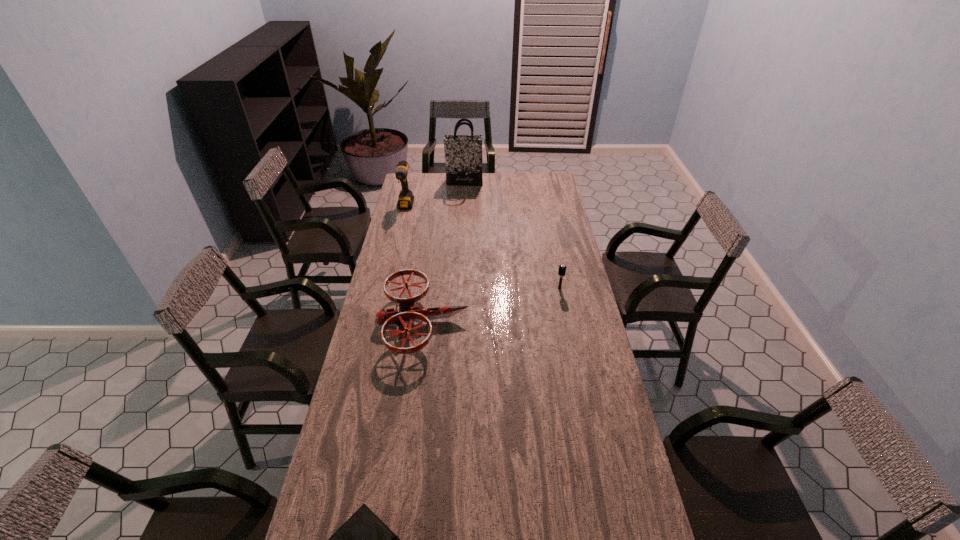
I want to click on vacant region located on the right of the second shortest object, so click(560, 323).

I want to click on object located at the far edge, so coord(463,153).

At what (x,y) coordinates should I click in order to perform the action: click on drill at the left edge. Please return your answer as a coordinate pair (x, y). This screenshot has width=960, height=540. Looking at the image, I should click on (406, 198).

Locate an element on the screen. This screenshot has width=960, height=540. drone that is at the left edge is located at coordinates (406, 312).

Find the location of a particular element. Image resolution: width=960 pixels, height=540 pixels. object situated at the right edge is located at coordinates (562, 268).

In the image, there is a desktop. Where is `vacant space at the far edge`? vacant space at the far edge is located at coordinates (460, 194).

Image resolution: width=960 pixels, height=540 pixels. In the image, there is a desktop. What are the coordinates of `free space at the left edge` in the screenshot? It's located at (392, 224).

This screenshot has width=960, height=540. I want to click on vacant space at the right edge of the desktop, so click(553, 220).

Find the location of a particular element. free point at the far left corner is located at coordinates [415, 192].

Identify the location of empty space between the rightmost object and the second shortest object. (492, 306).